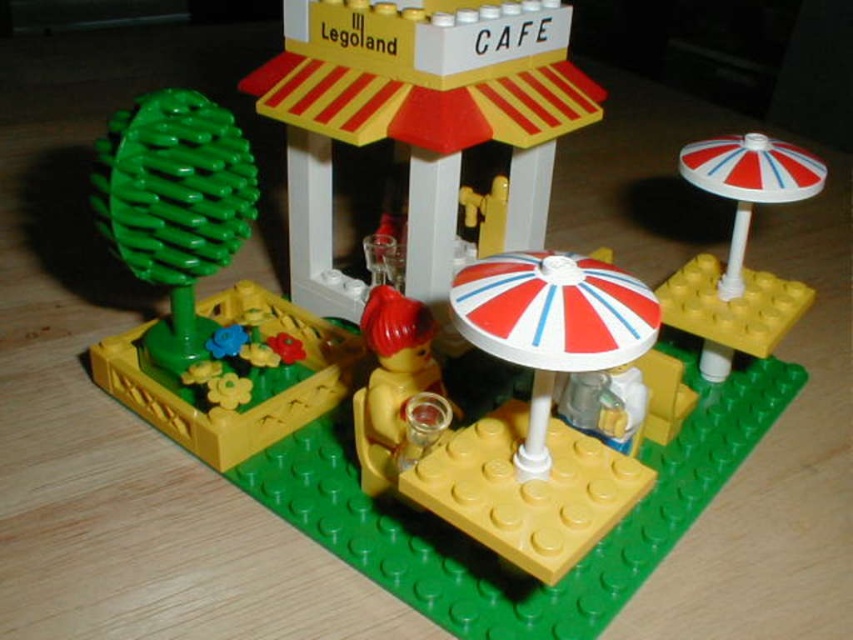
You are a visitor at Legoland and want to take a photo of the white plastic building at center and the white striped umbrella at upper right. Which object should you focus on first to ensure it appears larger in your photo?

The white plastic building at center is closer to the viewer than the white striped umbrella at upper right, so focusing on it first will make it appear larger in the photo.

You are planning to place a new Lego figure at the Legoland Cafe scene. The white plastic building at center and the white striped umbrella at upper right are already present. Which object would you need to move if you want to place the figure between them without overlapping?

Since the white plastic building at center is wider than the white striped umbrella at upper right, you would need to move the white plastic building at center to create enough space between them for the new Lego figure.